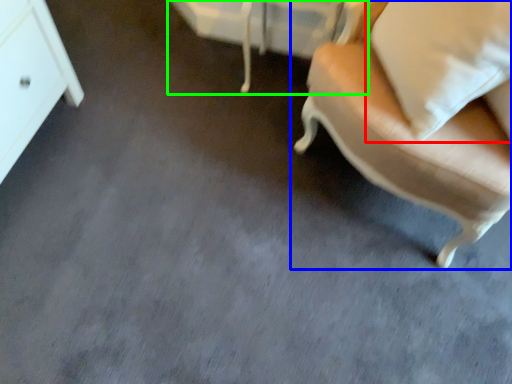
Question: Which object is the farthest from pillow (highlighted by a red box)? Choose among these: chair (highlighted by a blue box) or vanity (highlighted by a green box).

Choices:
 (A) chair
 (B) vanity

Answer: (B)